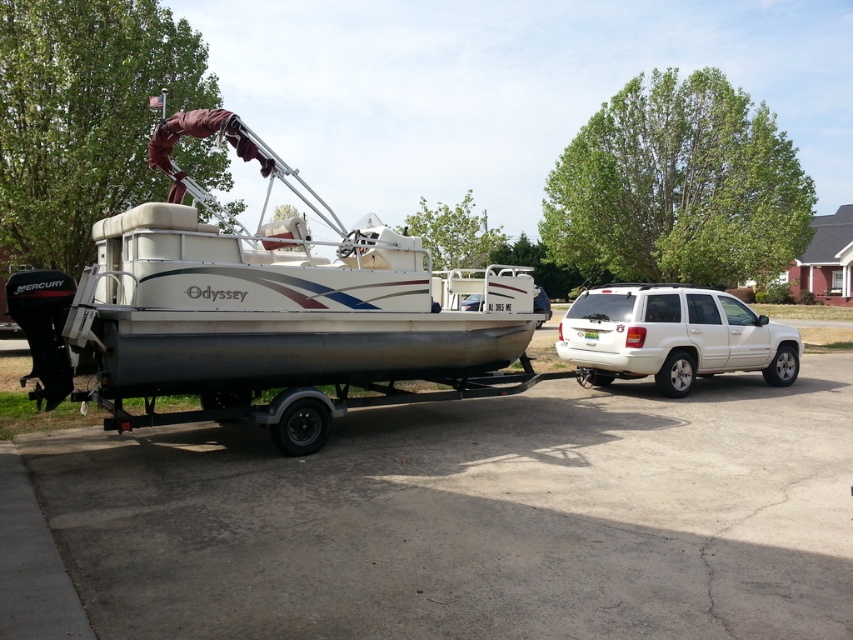
You are a delivery driver who needs to pass through a narrow alley that is only 2 meters wide. You see the white matte suv at right and the white matte boat at center in the scene. Which vehicle can fit through the alley without needing to adjust its position?

The white matte suv at right is thinner than the white matte boat at center, so the white matte suv at right can fit through the alley without needing to adjust its position.

Please determine the 2D coordinates of the silver metallic pontoon boat at left in the image. The coordinate system is defined with the origin at the bottom left corner of the image, where the x and y axes increase to the right and upwards respectively. The entire image is normalized to a unit square. Please provide your answer in the format of a tuple with two decimal places, e.g., 0.50, 0.50.

The 2D coordinates of the silver metallic pontoon boat at left are at point (x=263, y=312).